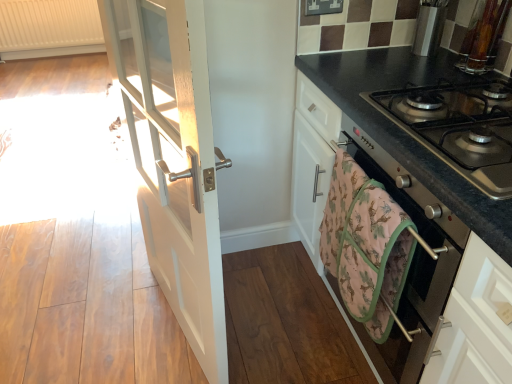
Locate an element on the screen. free spot in front of white textured radiator at upper left is located at coordinates (42, 85).